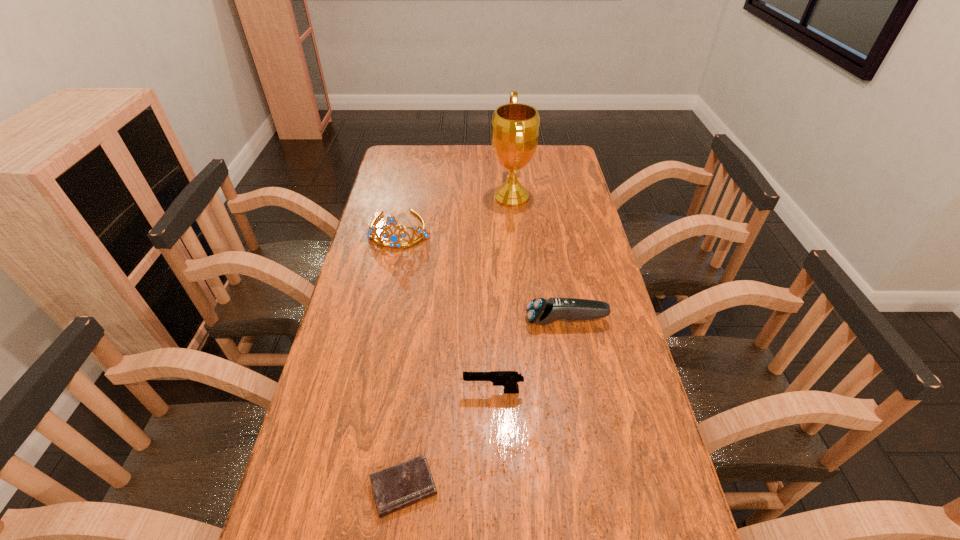
Image resolution: width=960 pixels, height=540 pixels. In the image, there is a desktop. Find the location of `vacant space at the far edge`. vacant space at the far edge is located at coordinates (529, 166).

The image size is (960, 540). In the image, there is a desktop. In order to click on free region at the left edge in this screenshot , I will do `click(299, 457)`.

Find the location of `free spot at the right edge of the desktop`. free spot at the right edge of the desktop is located at coordinates (592, 221).

This screenshot has width=960, height=540. I want to click on empty location between the third nearest object and the second tallest object, so click(483, 275).

Identify the location of vacant space in between the fourth shortest object and the fourth farthest object. (446, 310).

The height and width of the screenshot is (540, 960). In order to click on free space that is in between the shortest object and the electric shaver in this screenshot , I will do `click(485, 404)`.

Find the location of a particular element. empty location between the shortest object and the electric shaver is located at coordinates (485, 404).

The image size is (960, 540). In order to click on vacant point located between the third farthest object and the tallest object in this screenshot , I will do `click(539, 259)`.

The width and height of the screenshot is (960, 540). Find the location of `vacant point located between the third farthest object and the tallest object`. vacant point located between the third farthest object and the tallest object is located at coordinates (539, 259).

Identify the location of vacant point located between the award and the pistol. (502, 294).